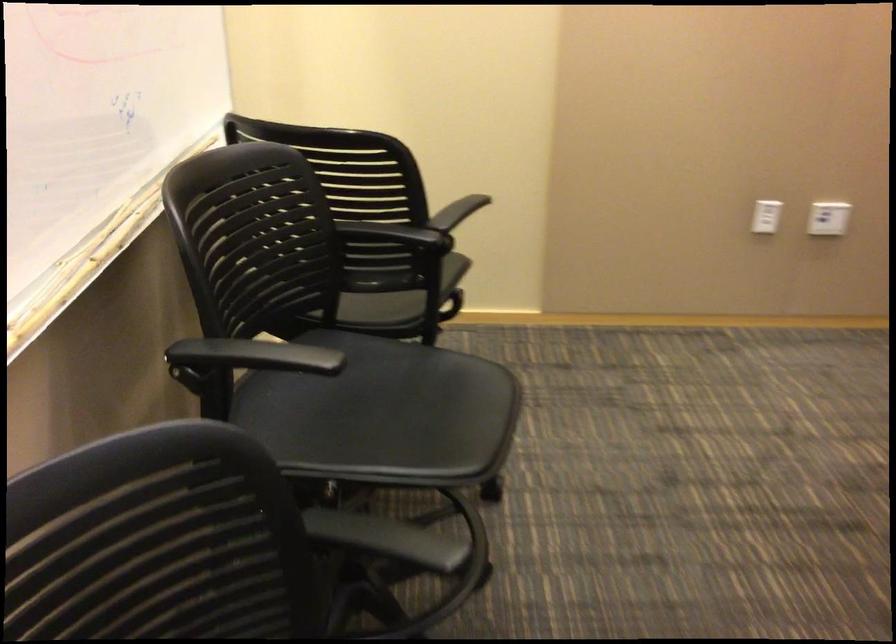
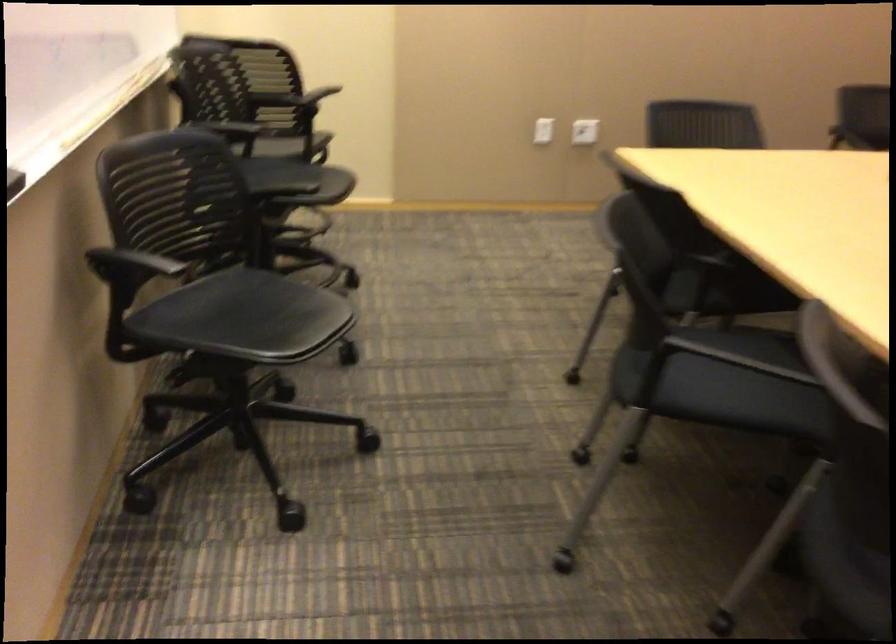
Question: Which direction would the cameraman need to move to produce the second image? Reply with the corresponding letter.

Choices:
 (A) Left
 (B) Right
 (C) Forward
 (D) Backward

Answer: (D)